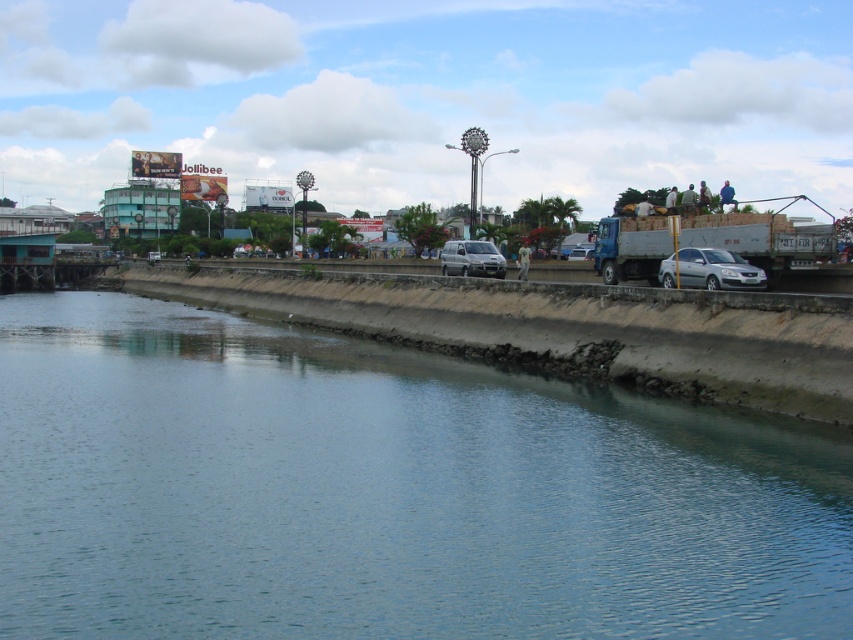
Does clear water at lower left appear on the right side of silver metallic sedan at center?

No, clear water at lower left is not to the right of silver metallic sedan at center.

The image size is (853, 640). Describe the element at coordinates (386, 492) in the screenshot. I see `clear water at lower left` at that location.

The height and width of the screenshot is (640, 853). Identify the location of clear water at lower left. (386, 492).

The image size is (853, 640). I want to click on clear water at lower left, so click(386, 492).

Is point (292, 397) behind point (592, 253)?

That is False.

Does clear water at lower left have a larger size compared to matte silver van at center?

Correct, clear water at lower left is larger in size than matte silver van at center.

Is point (212, 346) positioned in front of point (572, 252)?

Yes, point (212, 346) is in front of point (572, 252).

The height and width of the screenshot is (640, 853). I want to click on clear water at lower left, so click(x=386, y=492).

Does point (497, 401) come in front of point (469, 246)?

Yes, point (497, 401) is in front of point (469, 246).

Is clear water at lower left positioned at the back of satin silver van at center?

No, clear water at lower left is closer to the viewer.

Find the location of a particular element. This screenshot has width=853, height=640. clear water at lower left is located at coordinates (386, 492).

The image size is (853, 640). I want to click on clear water at lower left, so click(x=386, y=492).